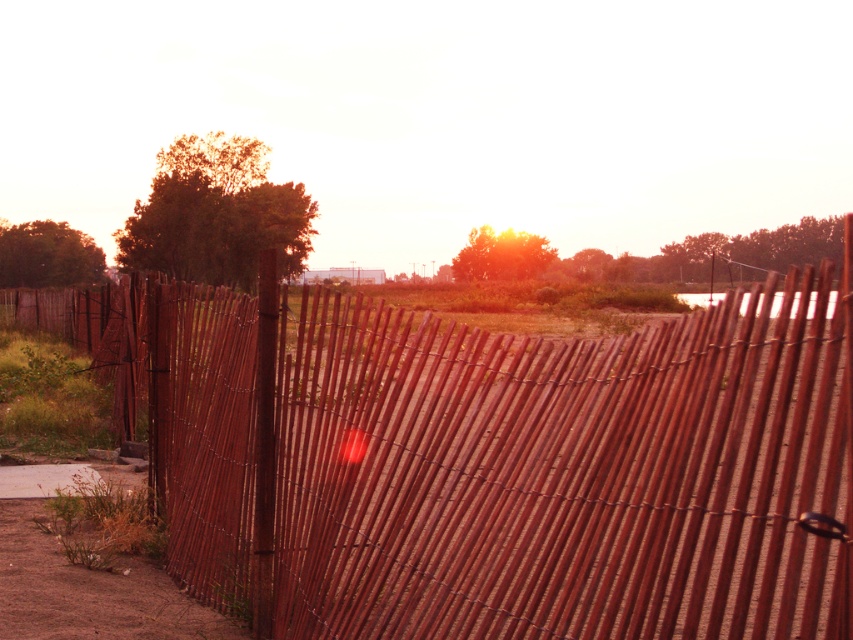
You are standing at the center of the image and want to walk towards the wooden fence at center. In which direction should you move relative to your current position?

Since the wooden fence at center is located at point (492, 461), you should move towards the right and slightly downward from your current position at the center to reach it.

You are standing at the brown sandy dirt track at lower left and want to reach the wooden fence at center. Which direction should you move to get there?

The wooden fence at center is located above the brown sandy dirt track at lower left, so you should move upward to reach it.